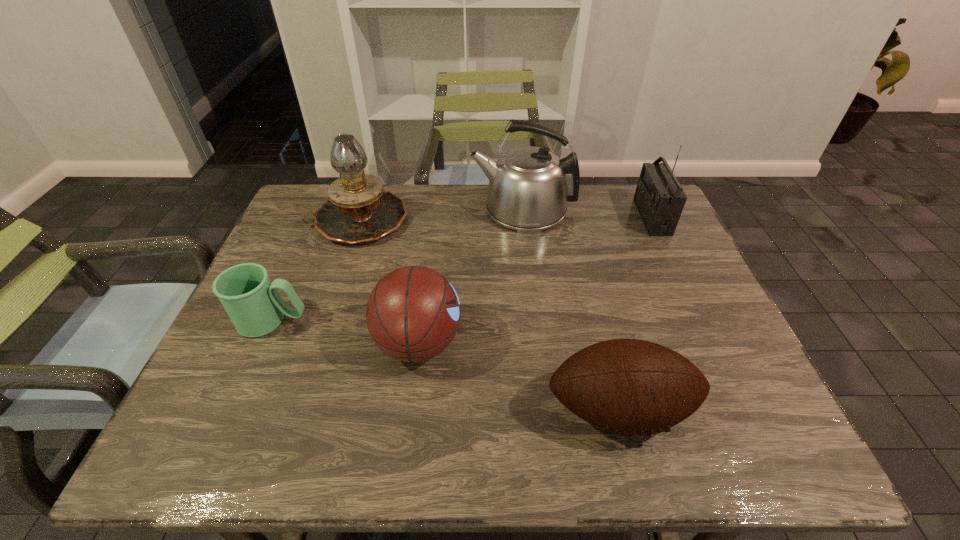
Find the location of a particular element. vacant space located on the front panel of the rightmost object is located at coordinates (605, 217).

Identify the location of free spot located on the front panel of the rightmost object. This screenshot has width=960, height=540. (527, 217).

Locate an element on the screen. vacant space situated on the front of the oil lamp is located at coordinates (311, 363).

You are a GUI agent. You are given a task and a screenshot of the screen. Output one action in this format:
    pyautogui.click(x=<x>, y=<y>)
    Task: Click on the vacant position located 0.260m on the left of the basketball
    The image size is (960, 540).
    Given the screenshot: What is the action you would take?
    pyautogui.click(x=262, y=342)

Find the location of a particular element. This screenshot has width=960, height=540. vacant space located on the side of the shortest object with the handle is located at coordinates (365, 321).

Where is `kettle that is at the far edge`? The image size is (960, 540). kettle that is at the far edge is located at coordinates pyautogui.click(x=529, y=187).

I want to click on radio receiver that is at the far edge, so click(x=659, y=197).

What are the coordinates of `oil lamp present at the far edge` in the screenshot? It's located at (359, 210).

Identify the location of object at the near edge. (627, 386).

The image size is (960, 540). In order to click on oil lamp that is at the left edge in this screenshot , I will do `click(359, 210)`.